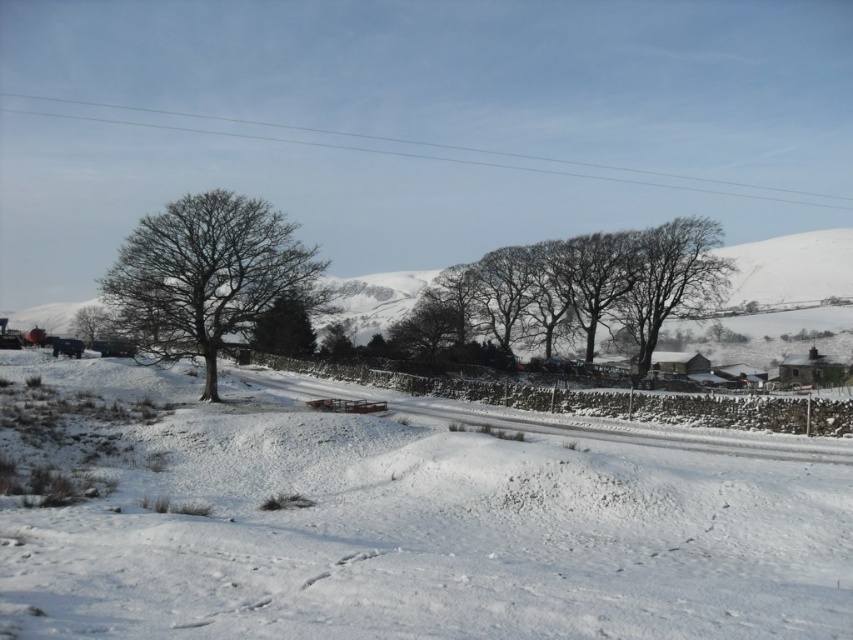
From the picture: Who is positioned more to the left, white powdery snow at center or bare wood tree at left?

From the viewer's perspective, bare wood tree at left appears more on the left side.

Is white powdery snow at center smaller than bare wood tree at left?

Actually, white powdery snow at center might be larger than bare wood tree at left.

Is point (384, 620) farther from camera compared to point (184, 310)?

No, (384, 620) is closer to viewer.

Find the location of a particular element. The width and height of the screenshot is (853, 640). white powdery snow at center is located at coordinates (392, 524).

Is point (178, 324) positioned in front of point (705, 244)?

Yes, it is.

Identify the location of bare wood tree at left. This screenshot has height=640, width=853. (207, 275).

You are a GUI agent. You are given a task and a screenshot of the screen. Output one action in this format:
    pyautogui.click(x=<x>, y=<y>)
    Task: Click on the bare wood tree at left
    
    Given the screenshot: What is the action you would take?
    pyautogui.click(x=207, y=275)

Does bare wood tree at left have a smaller size compared to green leafy tree at center?

Indeed, bare wood tree at left has a smaller size compared to green leafy tree at center.

Who is more distant from viewer, (200, 278) or (273, 304)?

Point (200, 278)

Is point (105, 275) positioned in front of point (300, 324)?

Yes.

I want to click on bare wood tree at left, so click(x=207, y=275).